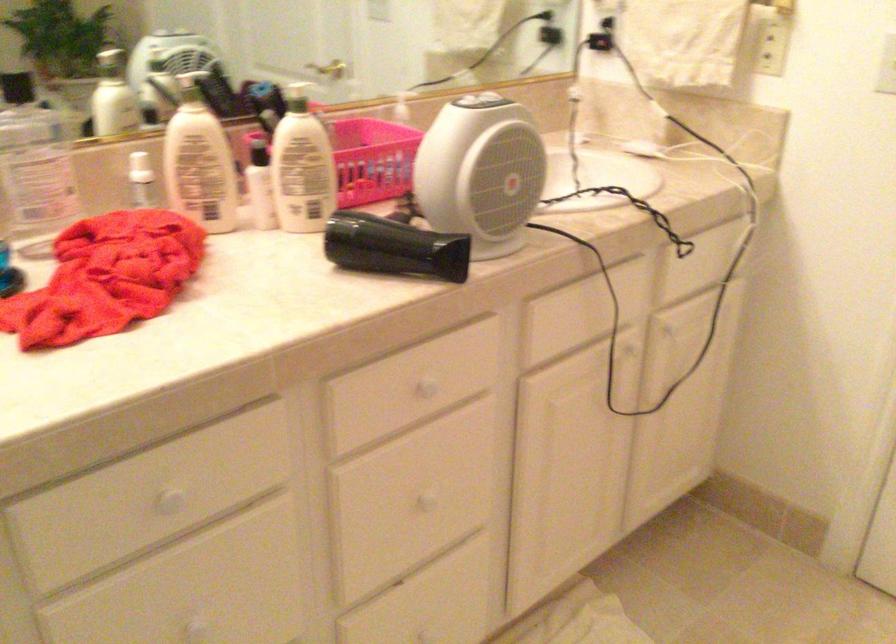
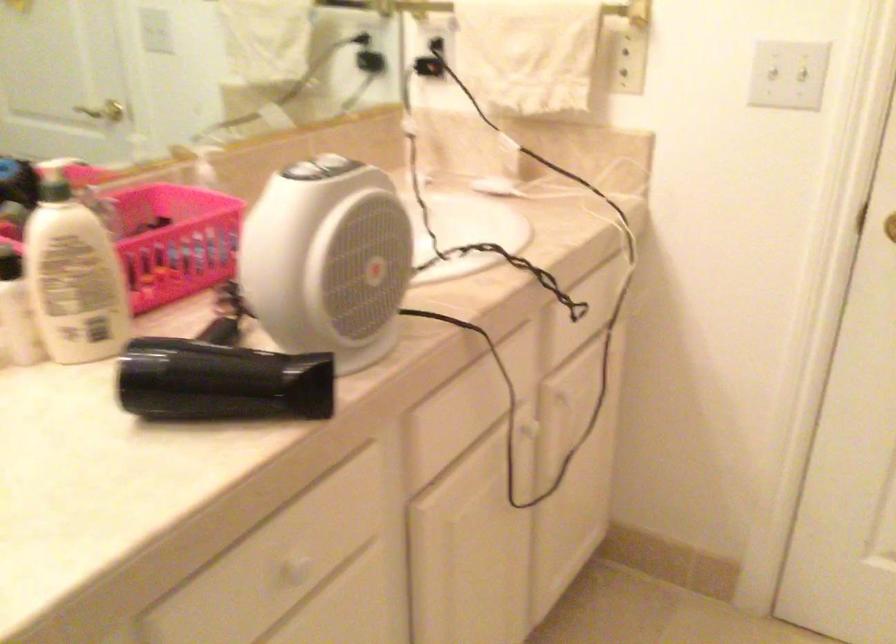
Question: The camera is either moving clockwise (left) or counter-clockwise (right) around the object. The first image is from the beginning of the video and the second image is from the end. Is the camera moving left or right when shooting the video?

Choices:
 (A) Left
 (B) Right

Answer: (A)